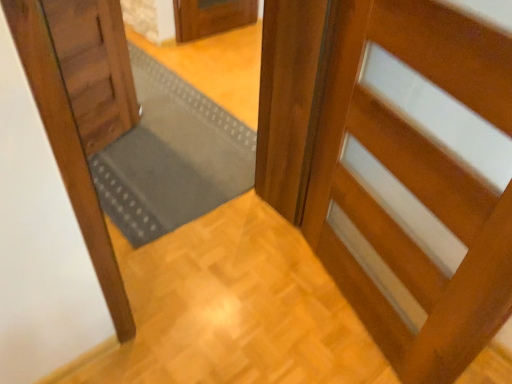
Where is `free spot below wooden door at left, placed as the 1th door when sorted from left to right (from a real-world perspective)`? free spot below wooden door at left, placed as the 1th door when sorted from left to right (from a real-world perspective) is located at coordinates (118, 148).